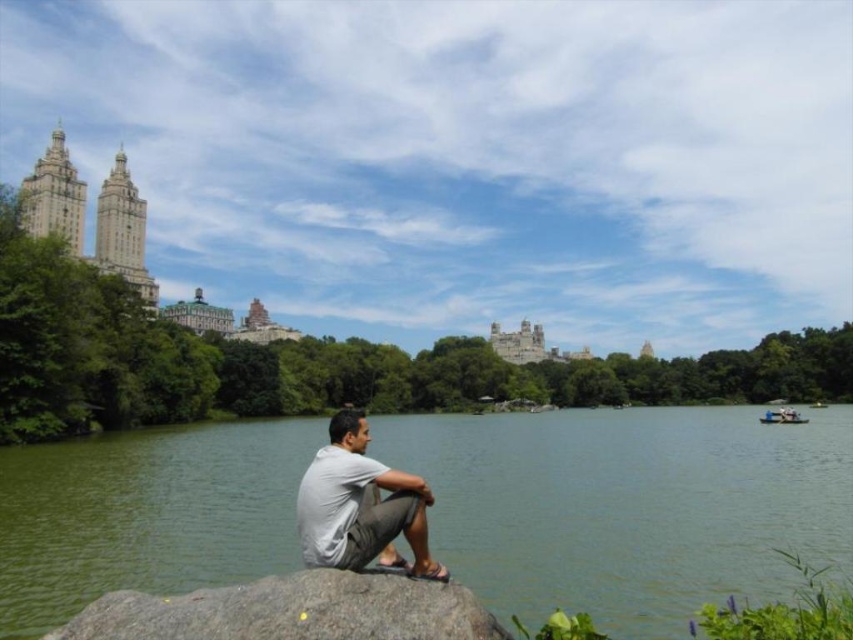
You are standing at the edge of the water in the park scene and want to sit down on the gray granite rock at lower center. According to the coordinates provided, is the rock located closer to the center or the edge of the image?

The gray granite rock at lower center is located at coordinates point (x=292, y=611). Since the x coordinate is 0.955, which is closer to 1.0, the rock is positioned near the right edge of the image.

You are a photographer planning to take a wide shot of the green water at lower center and the gray granite rock at lower center. Based on their sizes, which object should you focus on to ensure both are clearly visible in the frame?

The green water at lower center has a larger size compared to the gray granite rock at lower center, so focusing on the green water at lower center would ensure both are clearly visible in the frame.

You are standing in the park and want to take a photo of the gray granite rock at lower center and the gray cotton shirt at lower center. Which object should you focus on first to ensure both are in the frame?

You should focus on the gray granite rock at lower center first because it is closer to the viewer than the gray cotton shirt at lower center, ensuring both are in the frame.